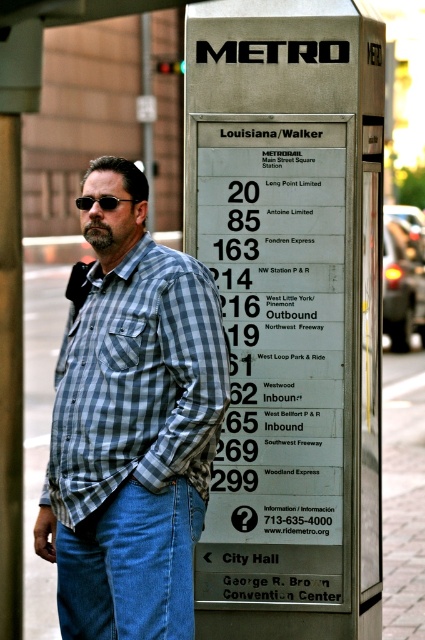
Question: Which point appears farthest from the camera in this image?

Choices:
 (A) (158, 572)
 (B) (101, 208)
 (C) (62, 397)
 (D) (260, 250)

Answer: (D)

Question: Observing the image, what is the correct spatial positioning of metallic silver sign at center in reference to blue denim jeans at lower left?

Choices:
 (A) left
 (B) right

Answer: (B)

Question: Which of the following is the closest to the observer?

Choices:
 (A) checkered shirt at center
 (B) blue denim jeans at lower left

Answer: (B)

Question: Which object appears farthest from the camera in this image?

Choices:
 (A) metallic silver sign at center
 (B) blue denim jeans at lower left

Answer: (A)

Question: Can you confirm if metallic silver sign at center is wider than checkered shirt at center?

Choices:
 (A) no
 (B) yes

Answer: (B)

Question: In this image, where is metallic silver sign at center located relative to checkered shirt at center?

Choices:
 (A) right
 (B) left

Answer: (A)